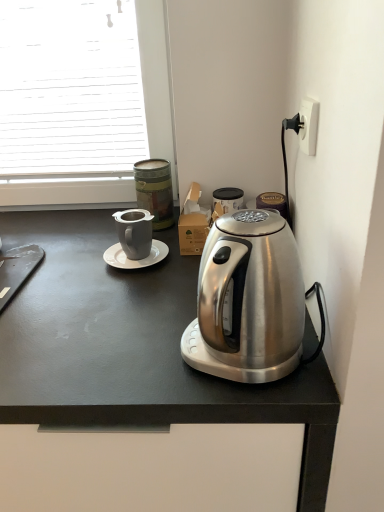
This screenshot has height=512, width=384. Identify the location of vacant space that is in between satin silver kettle at right and white glossy saucer at center. (154, 306).